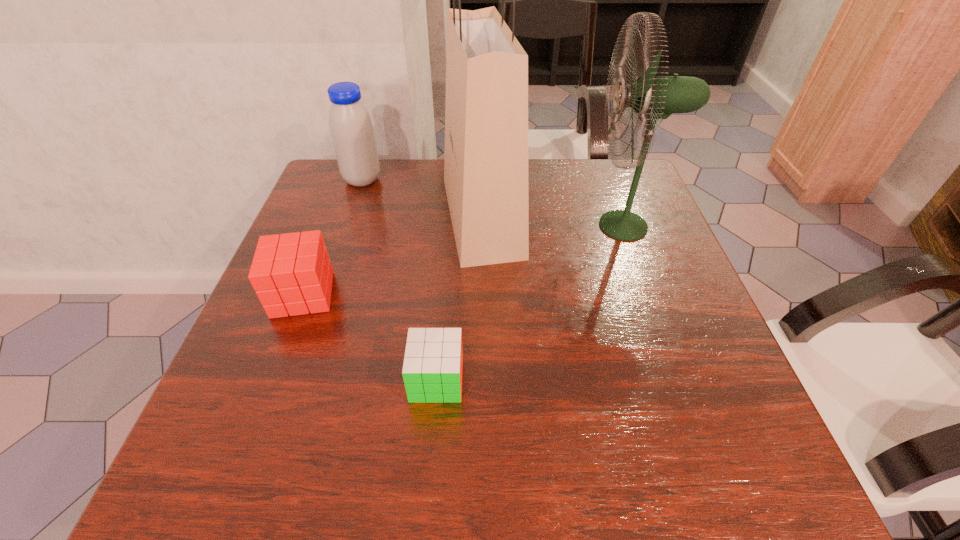
Locate an element on the screen. object that is at the far left corner is located at coordinates (351, 129).

Locate an element on the screen. Image resolution: width=960 pixels, height=540 pixels. object present at the far right corner is located at coordinates point(652,97).

Where is `free location at the far edge of the desktop`? The image size is (960, 540). free location at the far edge of the desktop is located at coordinates (389, 168).

The image size is (960, 540). I want to click on vacant space at the near edge of the desktop, so click(554, 490).

Locate an element on the screen. free space at the left edge is located at coordinates (259, 308).

I want to click on vacant space at the right edge of the desktop, so click(709, 368).

I want to click on vacant position at the far left corner of the desktop, so click(319, 203).

Identify the location of vacant space at the far right corner of the desktop. Image resolution: width=960 pixels, height=540 pixels. (631, 163).

Locate an element on the screen. free space between the shopping bag and the fan is located at coordinates (553, 221).

This screenshot has width=960, height=540. Identify the location of free space that is in between the soya milk and the nearest object. (399, 280).